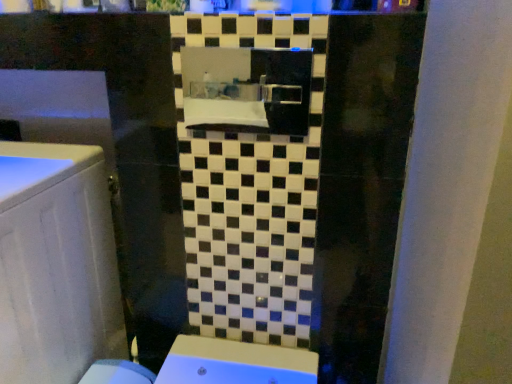
From the picture: What is the approximate height of white glossy cabinet at left?

white glossy cabinet at left is 85.15 centimeters in height.

This screenshot has width=512, height=384. What do you see at coordinates (56, 264) in the screenshot? I see `white glossy cabinet at left` at bounding box center [56, 264].

Measure the distance between white glossy cabinet at left and camera.

They are 28.71 inches apart.

Where is `white glossy cabinet at left`? The height and width of the screenshot is (384, 512). white glossy cabinet at left is located at coordinates (x=56, y=264).

I want to click on satin black mirror at center, so click(247, 89).

This screenshot has width=512, height=384. What do you see at coordinates (247, 89) in the screenshot?
I see `satin black mirror at center` at bounding box center [247, 89].

In order to face satin black mirror at center, should I rotate leftwards or rightwards?

To face it directly, rotate left by 1.461 degrees.

Locate an element on the screen. The width and height of the screenshot is (512, 384). white glossy cabinet at left is located at coordinates [x=56, y=264].

Considering the positions of objects satin black mirror at center and white glossy cabinet at left in the image provided, who is more to the left, satin black mirror at center or white glossy cabinet at left?

white glossy cabinet at left.

Between satin black mirror at center and white glossy cabinet at left, which one is positioned in front?

white glossy cabinet at left is closer to the camera.

Which is behind, point (188, 113) or point (5, 166)?

The point (188, 113) is farther.

From the image's perspective, between satin black mirror at center and white glossy cabinet at left, who is located below?

From the image's view, white glossy cabinet at left is below.

From a real-world perspective, is satin black mirror at center physically located above or below white glossy cabinet at left?

In terms of real-world spatial position, satin black mirror at center is above white glossy cabinet at left.

Looking at their sizes, would you say satin black mirror at center is wider or thinner than white glossy cabinet at left?

Considering their sizes, satin black mirror at center looks slimmer than white glossy cabinet at left.

Considering the sizes of objects satin black mirror at center and white glossy cabinet at left in the image provided, who is taller, satin black mirror at center or white glossy cabinet at left?

Standing taller between the two is white glossy cabinet at left.

Which of these two, satin black mirror at center or white glossy cabinet at left, is smaller?

satin black mirror at center is smaller.

Looking at this image, is satin black mirror at center inside the boundaries of white glossy cabinet at left, or outside?

satin black mirror at center is outside white glossy cabinet at left.

Is satin black mirror at center far away from white glossy cabinet at left?

Actually, satin black mirror at center and white glossy cabinet at left are a little close together.

Is satin black mirror at center positioned with its back to white glossy cabinet at left?

satin black mirror at center is not turned away from white glossy cabinet at left.

Consider the image. What's the angular difference between satin black mirror at center and white glossy cabinet at left's facing directions?

There is a 0.159-degree angle between the facing directions of satin black mirror at center and white glossy cabinet at left.

Identify the location of medicine cabinet above the white glossy cabinet at left (from the image's perspective). The image size is (512, 384). (247, 89).

Is white glossy cabinet at left at the right side of satin black mirror at center?

In fact, white glossy cabinet at left is to the left of satin black mirror at center.

Which object is closer to the camera taking this photo, white glossy cabinet at left or satin black mirror at center?

white glossy cabinet at left is in front.

Which is nearer, (60, 344) or (303, 108)?

Point (60, 344) appears to be farther away from the viewer than point (303, 108).

From the image's perspective, which is below, white glossy cabinet at left or satin black mirror at center?

From the image's view, white glossy cabinet at left is below.

From the picture: From a real-world perspective, is white glossy cabinet at left below satin black mirror at center?

Yes, from a real-world perspective, white glossy cabinet at left is under satin black mirror at center.

Looking at this image, considering the sizes of objects white glossy cabinet at left and satin black mirror at center in the image provided, who is wider, white glossy cabinet at left or satin black mirror at center?

With larger width is white glossy cabinet at left.

From their relative heights in the image, would you say white glossy cabinet at left is taller or shorter than satin black mirror at center?

white glossy cabinet at left is taller than satin black mirror at center.

Does white glossy cabinet at left have a larger size compared to satin black mirror at center?

Yes, white glossy cabinet at left is bigger than satin black mirror at center.

Is satin black mirror at center surrounded by white glossy cabinet at left?

Definitely not — satin black mirror at center is not inside white glossy cabinet at left.

Consider the image. Is white glossy cabinet at left far away from satin black mirror at center?

They are positioned close to each other.

Is white glossy cabinet at left turned away from satin black mirror at center?

That's not correct — white glossy cabinet at left is not looking away from satin black mirror at center.

Image resolution: width=512 pixels, height=384 pixels. In order to click on medicine cabinet that appears above the white glossy cabinet at left (from a real-world perspective) in this screenshot , I will do `click(247, 89)`.

I want to click on bathroom cabinet in front of the satin black mirror at center, so click(x=56, y=264).

The width and height of the screenshot is (512, 384). I want to click on bathroom cabinet below the satin black mirror at center (from a real-world perspective), so click(56, 264).